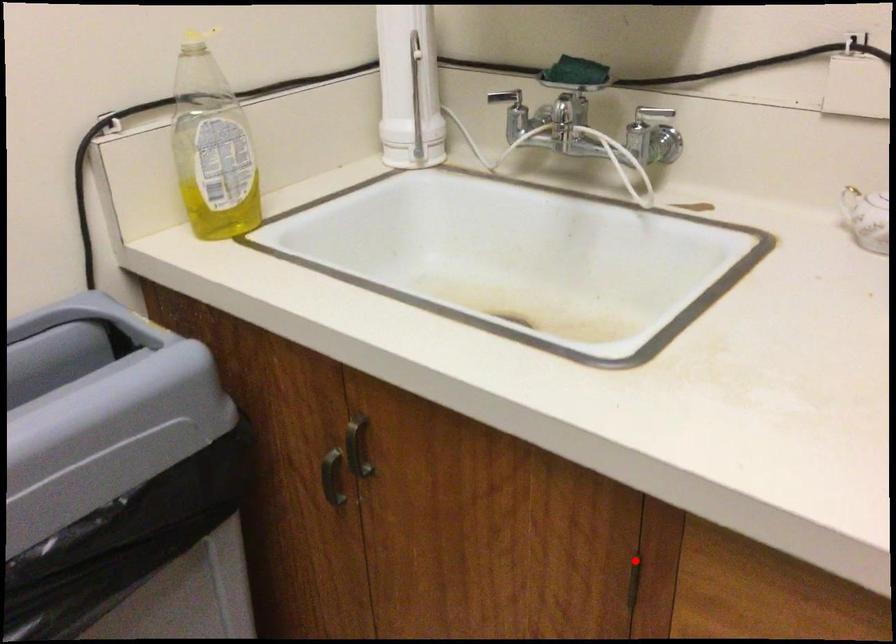
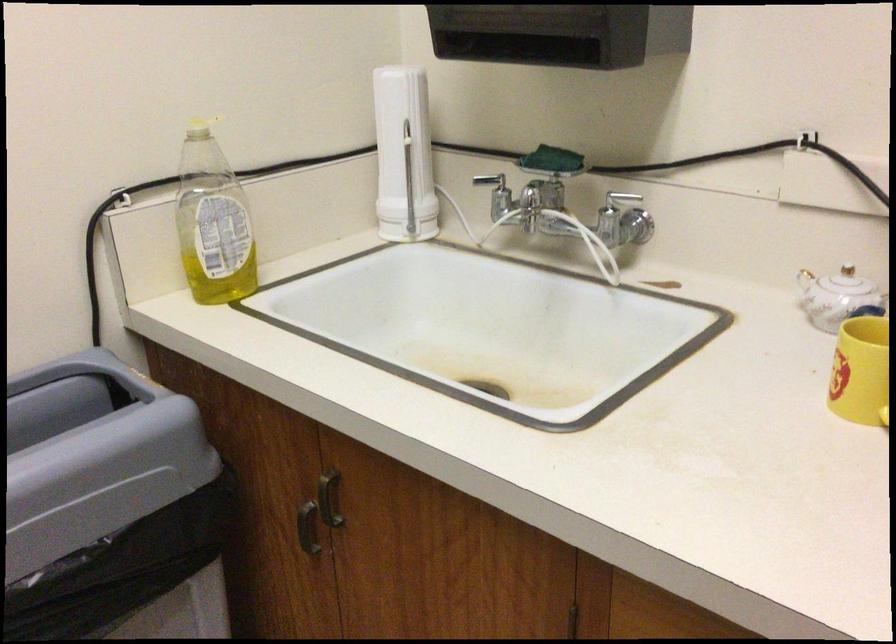
Find the pixel in the second image that matches the highlighted location in the first image.

(576, 623)